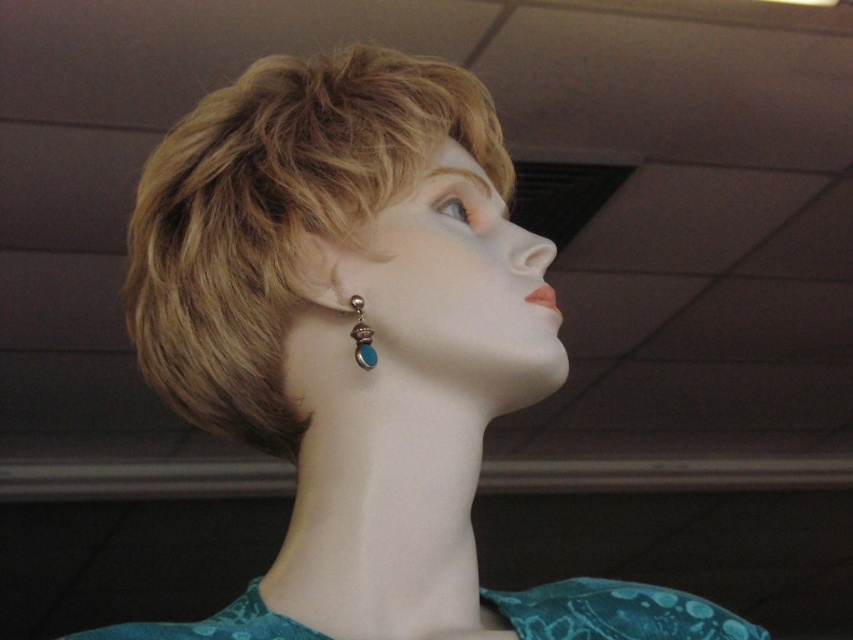
Based on the photo, is teal fabric dress at lower center in front of turquoise gemstone drop at lower left?

Yes, it is.

The height and width of the screenshot is (640, 853). What do you see at coordinates (613, 612) in the screenshot?
I see `teal fabric dress at lower center` at bounding box center [613, 612].

Who is more distant from viewer, (94, 634) or (357, 323)?

The point (357, 323) is more distant.

Locate an element on the screen. teal fabric dress at lower center is located at coordinates (613, 612).

Can you confirm if blonde hair at upper center is shorter than teal fabric dress at lower center?

In fact, blonde hair at upper center may be taller than teal fabric dress at lower center.

Between point (175, 392) and point (598, 612), which one is positioned behind?

Positioned behind is point (175, 392).

Which is behind, point (343, 99) or point (614, 596)?

The point (343, 99) is more distant.

Locate an element on the screen. The width and height of the screenshot is (853, 640). blonde hair at upper center is located at coordinates (277, 216).

Does point (200, 156) come farther from viewer compared to point (357, 323)?

That is True.

Does blonde hair at upper center appear under turquoise gemstone drop at lower left?

Incorrect, blonde hair at upper center is not positioned below turquoise gemstone drop at lower left.

Where is `blonde hair at upper center`? The width and height of the screenshot is (853, 640). blonde hair at upper center is located at coordinates (277, 216).